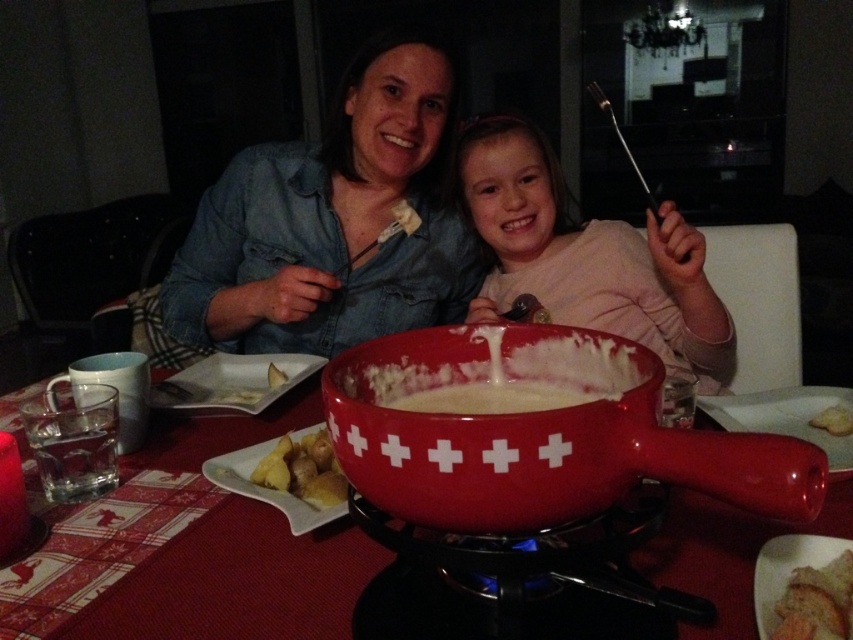
Is point (651, 212) positioned after point (834, 408)?

Yes, point (651, 212) is behind point (834, 408).

Who is more forward, (724,310) or (837,413)?

Positioned in front is point (837,413).

The height and width of the screenshot is (640, 853). I want to click on matte pink sweater at center, so click(x=587, y=256).

Which is above, matte ceramic fondue pot at center or golden potato at center?

matte ceramic fondue pot at center is higher up.

Is matte ceramic fondue pot at center thinner than golden potato at center?

No.

Where is `matte ceramic fondue pot at center`? This screenshot has width=853, height=640. matte ceramic fondue pot at center is located at coordinates (540, 435).

Where is `matte ceramic fondue pot at center`? matte ceramic fondue pot at center is located at coordinates (540, 435).

How far apart are matte pink sweater at center and golden potato at center?

A distance of 25.44 inches exists between matte pink sweater at center and golden potato at center.

Image resolution: width=853 pixels, height=640 pixels. What do you see at coordinates (587, 256) in the screenshot? I see `matte pink sweater at center` at bounding box center [587, 256].

Which is behind, point (660, 228) or point (288, 454)?

The point (660, 228) is more distant.

Image resolution: width=853 pixels, height=640 pixels. Identify the location of matte pink sweater at center. (587, 256).